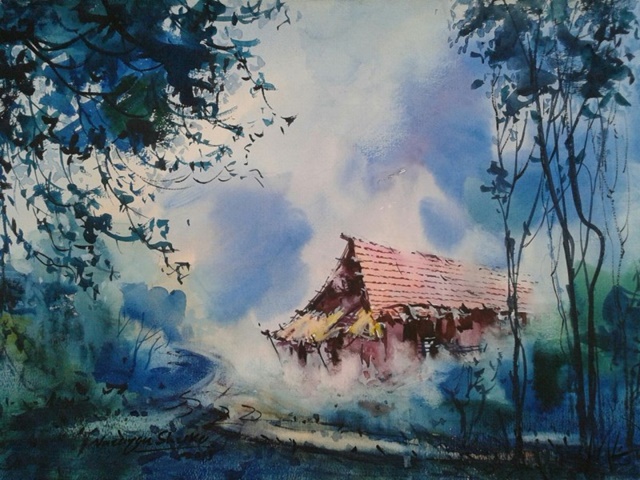
Where is `dust`? The height and width of the screenshot is (480, 640). dust is located at coordinates (419, 397), (492, 384), (297, 394).